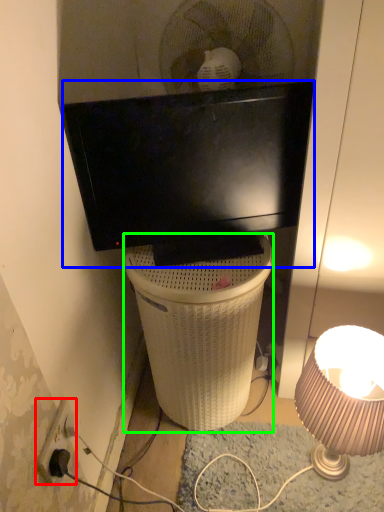
Question: Which object is the farthest from power outlet (highlighted by a red box)? Choose among these: television (highlighted by a blue box) or trash bin/can (highlighted by a green box).

Choices:
 (A) television
 (B) trash bin/can

Answer: (A)